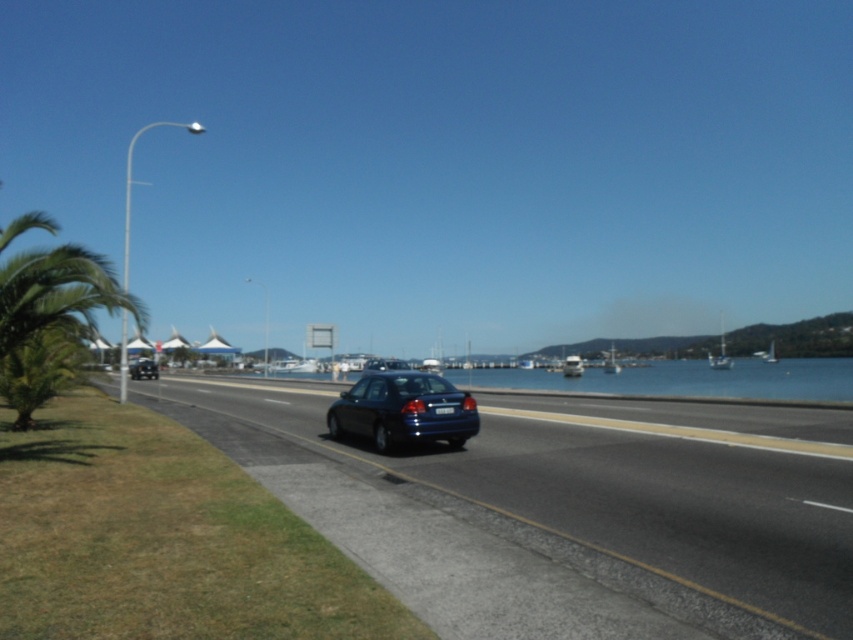
Question: Is blue water at center positioned at the back of shiny black sedan at lower left?

Choices:
 (A) yes
 (B) no

Answer: (B)

Question: Which of the following is the farthest from the observer?

Choices:
 (A) glossy blue car at center
 (B) blue water at center
 (C) shiny black sedan at lower left

Answer: (C)

Question: Estimate the real-world distances between objects in this image. Which object is closer to the shiny black sedan at lower left?

Choices:
 (A) green leafy palm tree at left
 (B) blue water at center
 (C) glossy blue car at center

Answer: (A)

Question: Can you confirm if glossy blue sedan at center is thinner than black plastic license plate at center?

Choices:
 (A) no
 (B) yes

Answer: (A)

Question: Is glossy blue sedan at center in front of black plastic license plate at center?

Choices:
 (A) no
 (B) yes

Answer: (B)

Question: Which point appears farthest from the camera in this image?

Choices:
 (A) (459, 429)
 (B) (137, 364)
 (C) (662, 365)
 (D) (1, 385)

Answer: (C)